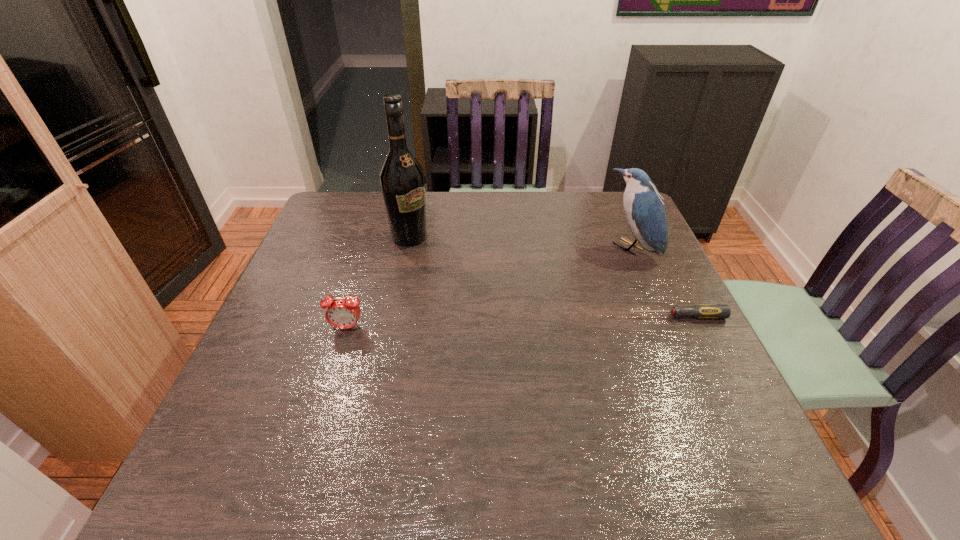
The height and width of the screenshot is (540, 960). I want to click on the second shortest object, so click(341, 313).

Identify the location of the nearest object. (341, 313).

Locate an element on the screen. screwdriver is located at coordinates (701, 311).

Where is `the third farthest object`? the third farthest object is located at coordinates (701, 311).

This screenshot has width=960, height=540. What are the coordinates of `bird` in the screenshot? It's located at (644, 209).

Find the location of `wine bottle`. wine bottle is located at coordinates (402, 180).

This screenshot has height=540, width=960. What are the coordinates of `vacant space positioned on the face of the alarm clock` in the screenshot? It's located at (318, 423).

The width and height of the screenshot is (960, 540). Identify the location of free space located 0.090m insert the third farthest object into a screw head. (590, 316).

Identify the location of free space located 0.210m insert the third farthest object into a screw head. (540, 316).

I want to click on free point located insert the third farthest object into a screw head, so click(x=528, y=316).